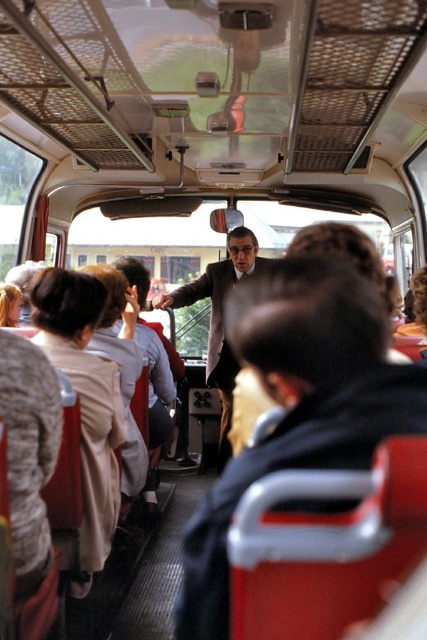
Where is `matte black jacket at center`? The image size is (427, 640). matte black jacket at center is located at coordinates (298, 404).

Can you confirm if matte black jacket at center is positioned below beige fabric coat at left?

Actually, matte black jacket at center is above beige fabric coat at left.

Which is in front, point (421, 388) or point (61, 545)?

Point (421, 388) is more forward.

Where is `matte black jacket at center`? This screenshot has width=427, height=640. matte black jacket at center is located at coordinates (298, 404).

Does beige fabric coat at left appear on the left side of dark gray suit at center?

Indeed, beige fabric coat at left is positioned on the left side of dark gray suit at center.

Describe the element at coordinates (84, 397) in the screenshot. I see `beige fabric coat at left` at that location.

You are a GUI agent. You are given a task and a screenshot of the screen. Output one action in this format:
    pyautogui.click(x=<x>, y=<y>)
    Task: Click on the beige fabric coat at left
    Image resolution: width=427 pixels, height=640 pixels.
    Given the screenshot: What is the action you would take?
    pyautogui.click(x=84, y=397)

Does matte black jacket at center have a larger size compared to dark gray suit at center?

No.

Does matte black jacket at center have a greater width compared to dark gray suit at center?

Incorrect, matte black jacket at center's width does not surpass dark gray suit at center's.

Which is behind, point (251, 326) or point (246, 237)?

The point (246, 237) is more distant.

Identify the location of matte black jacket at center. (298, 404).